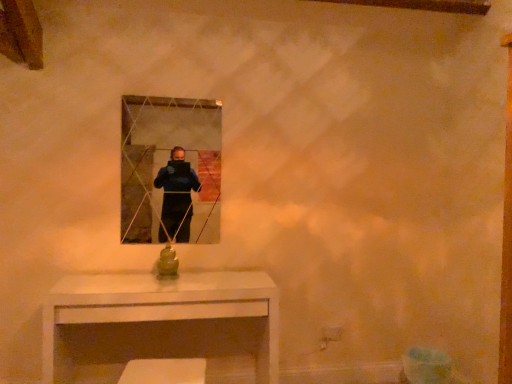
Question: Can you confirm if white glossy table at lower center is positioned to the right of clear glass mirror at center?

Choices:
 (A) yes
 (B) no

Answer: (A)

Question: Is the position of white glossy table at lower center more distant than that of clear glass mirror at center?

Choices:
 (A) yes
 (B) no

Answer: (B)

Question: From the image's perspective, is white glossy table at lower center located beneath clear glass mirror at center?

Choices:
 (A) no
 (B) yes

Answer: (B)

Question: From a real-world perspective, does white glossy table at lower center sit lower than clear glass mirror at center?

Choices:
 (A) no
 (B) yes

Answer: (B)

Question: Does white glossy table at lower center have a smaller size compared to clear glass mirror at center?

Choices:
 (A) no
 (B) yes

Answer: (A)

Question: Is clear glass mirror at center completely or partially inside white glossy table at lower center?

Choices:
 (A) no
 (B) yes

Answer: (A)

Question: Is clear glass mirror at center aimed at white glossy table at lower center?

Choices:
 (A) yes
 (B) no

Answer: (B)

Question: From a real-world perspective, is clear glass mirror at center located higher than white glossy table at lower center?

Choices:
 (A) no
 (B) yes

Answer: (B)

Question: Can you confirm if clear glass mirror at center is thinner than white glossy table at lower center?

Choices:
 (A) yes
 (B) no

Answer: (A)

Question: Is clear glass mirror at center looking in the opposite direction of white glossy table at lower center?

Choices:
 (A) no
 (B) yes

Answer: (A)

Question: Can you confirm if clear glass mirror at center is wider than white glossy table at lower center?

Choices:
 (A) no
 (B) yes

Answer: (A)

Question: From a real-world perspective, is clear glass mirror at center located beneath white glossy table at lower center?

Choices:
 (A) yes
 (B) no

Answer: (B)

Question: Is point (216, 192) positioned closer to the camera than point (226, 291)?

Choices:
 (A) farther
 (B) closer

Answer: (A)